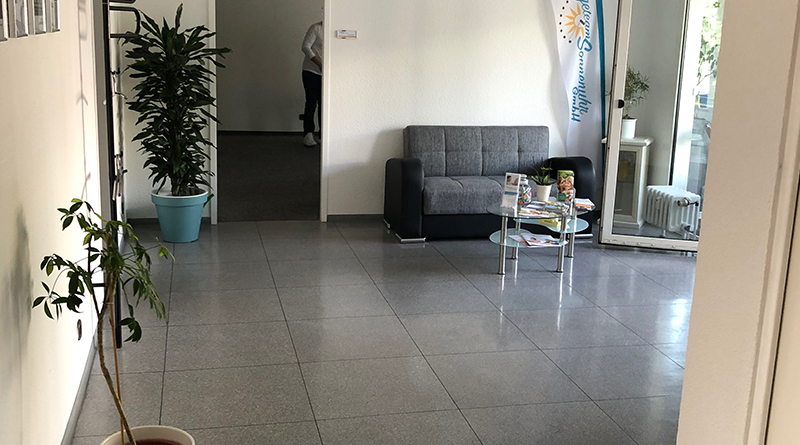
At what (x,y) coordinates should I click in order to perform the action: click on table. Please return your answer as a coordinate pair (x, y). Looking at the image, I should click on (538, 210), (566, 228), (518, 239).